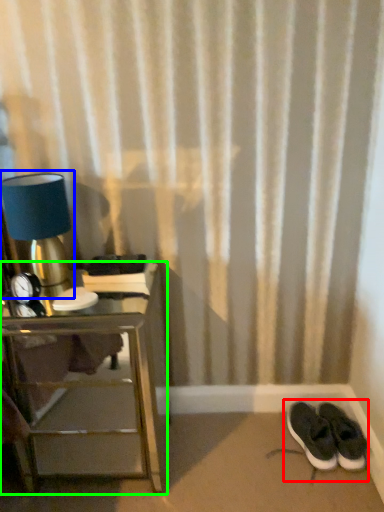
Question: Which is farther away from footwear (highlighted by a red box)? table lamp (highlighted by a blue box) or nightstand (highlighted by a green box)?

Choices:
 (A) table lamp
 (B) nightstand

Answer: (A)